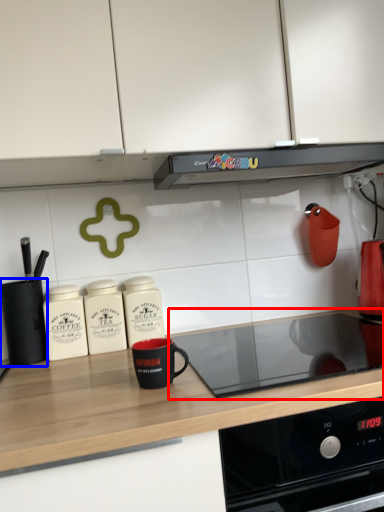
Question: Which point is further to the camera, gas stove (highlighted by a red box) or kitchen appliance (highlighted by a blue box)?

Choices:
 (A) gas stove
 (B) kitchen appliance

Answer: (B)